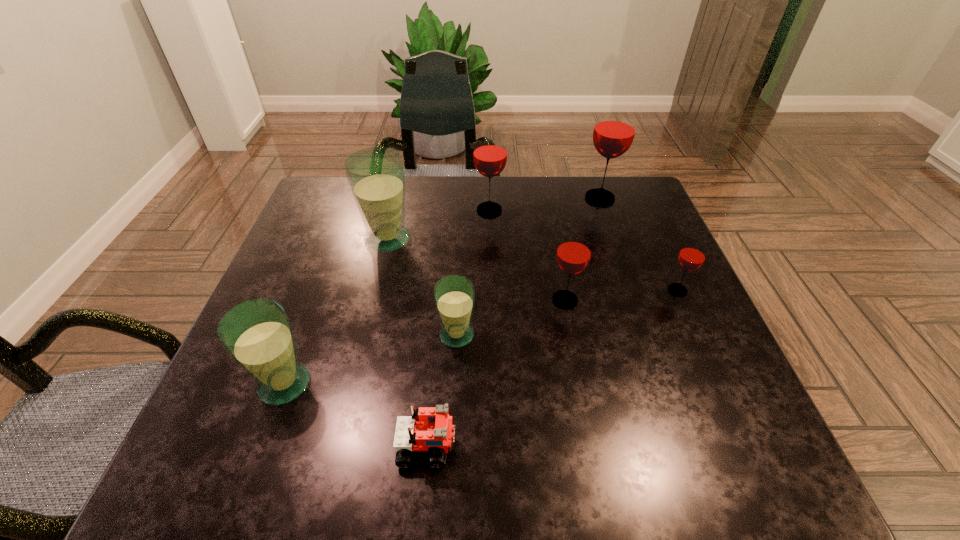
This screenshot has height=540, width=960. I want to click on the rightmost red glass, so click(x=692, y=255).

You are a GUI agent. You are given a task and a screenshot of the screen. Output one action in this format:
    pyautogui.click(x=<x>, y=<y>)
    Task: Click on the second nearest glass
    The width and height of the screenshot is (960, 540).
    Given the screenshot: What is the action you would take?
    pyautogui.click(x=454, y=295)

The height and width of the screenshot is (540, 960). I want to click on the sixth farthest object, so click(x=454, y=295).

This screenshot has height=540, width=960. I want to click on the shortest object, so click(x=430, y=428).

Where is `Lego`? This screenshot has width=960, height=540. Lego is located at coordinates (430, 428).

At what (x,y) coordinates should I click in order to perform the action: click on free point located 0.260m on the left of the tallest glass. Please return your answer as a coordinate pair (x, y). The width and height of the screenshot is (960, 540). Looking at the image, I should click on (491, 198).

The image size is (960, 540). In order to click on free space located 0.240m on the left of the third smallest red glass in this screenshot , I will do `click(387, 210)`.

I want to click on free location located on the left of the farthest blue glass, so click(x=327, y=239).

Locate an element on the screen. Image resolution: width=960 pixels, height=540 pixels. free space located 0.360m on the back of the second red glass from left to right is located at coordinates (546, 199).

Find the location of a particular element. This screenshot has height=540, width=960. vacant space located 0.140m on the back of the second smallest blue glass is located at coordinates (313, 307).